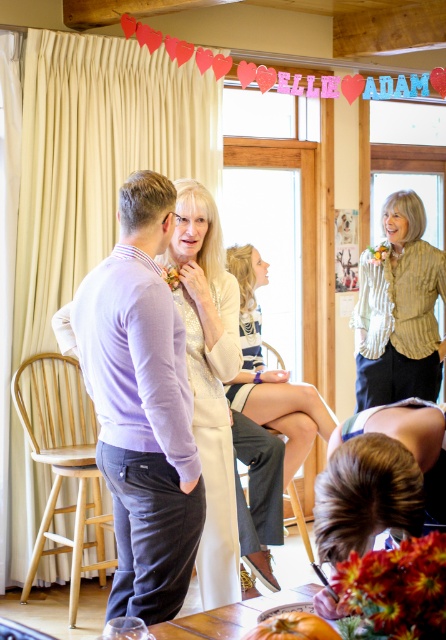
Question: Estimate the real-world distances between objects in this image. Which object is closer to the white textured dress at center?

Choices:
 (A) purple fabric shirt at left
 (B) purple sweater at center

Answer: (A)

Question: Which point is closer to the camera?

Choices:
 (A) green striped shirt at upper right
 (B) purple fabric shirt at left
 (C) purple sweater at center

Answer: (C)

Question: Which point is farther from the camera taking this photo?

Choices:
 (A) (331, 429)
 (B) (392, 392)

Answer: (B)

Question: Is purple sweater at center positioned before purple fabric shirt at left?

Choices:
 (A) yes
 (B) no

Answer: (A)

Question: Does green striped shirt at upper right have a greater width compared to white striped dress at center?

Choices:
 (A) yes
 (B) no

Answer: (B)

Question: Can you confirm if purple fabric shirt at left is wider than white textured dress at center?

Choices:
 (A) no
 (B) yes

Answer: (A)